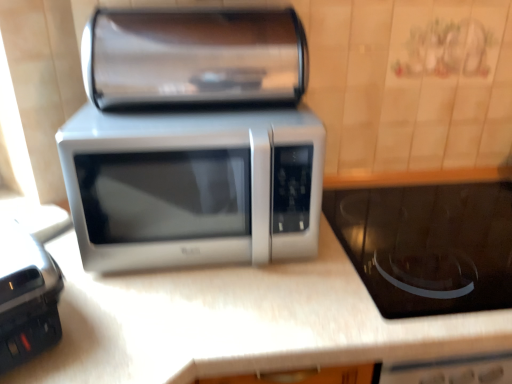
Identify the location of vacant space in front of satin silver microwave at center. (211, 316).